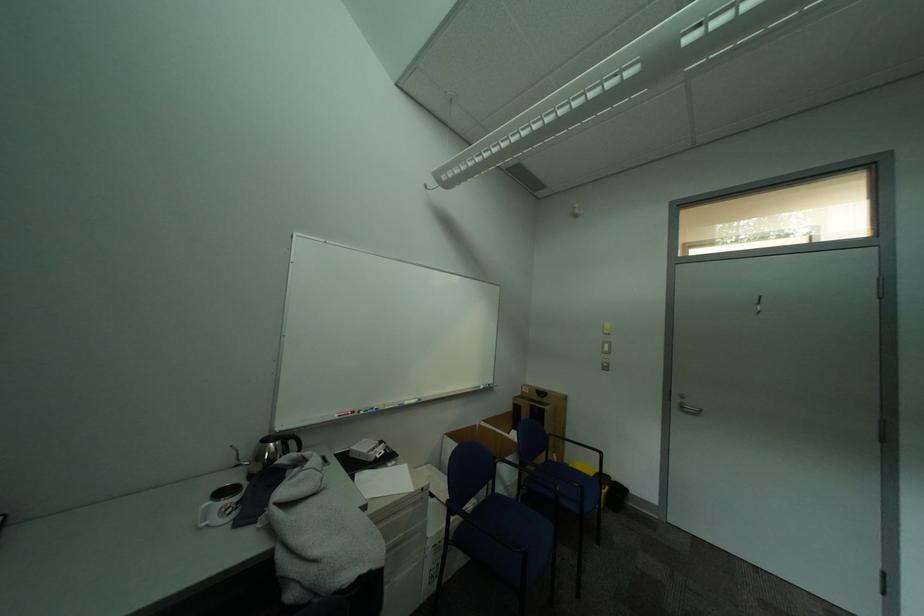
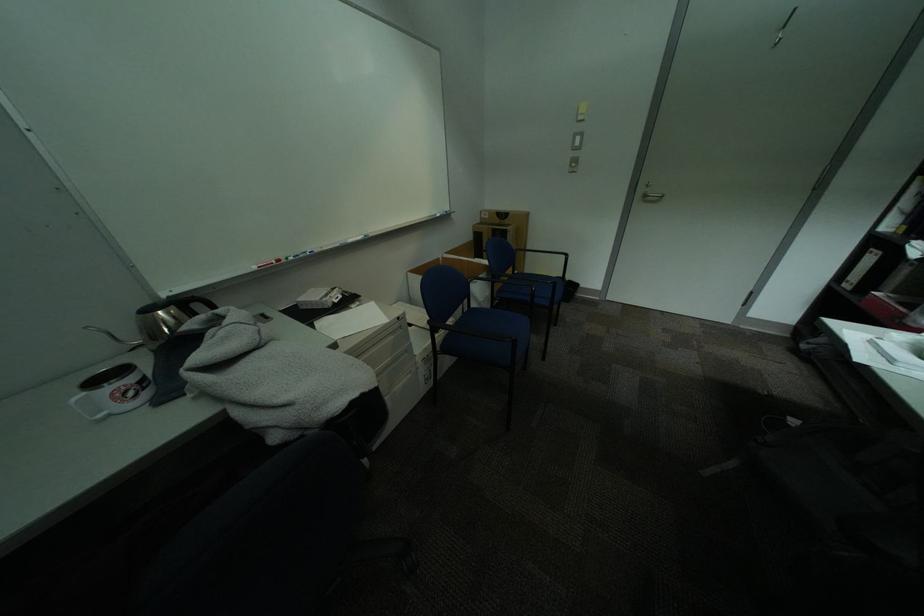
In the second image, find the point that corresponds to point (527, 398) in the first image.

(487, 225)